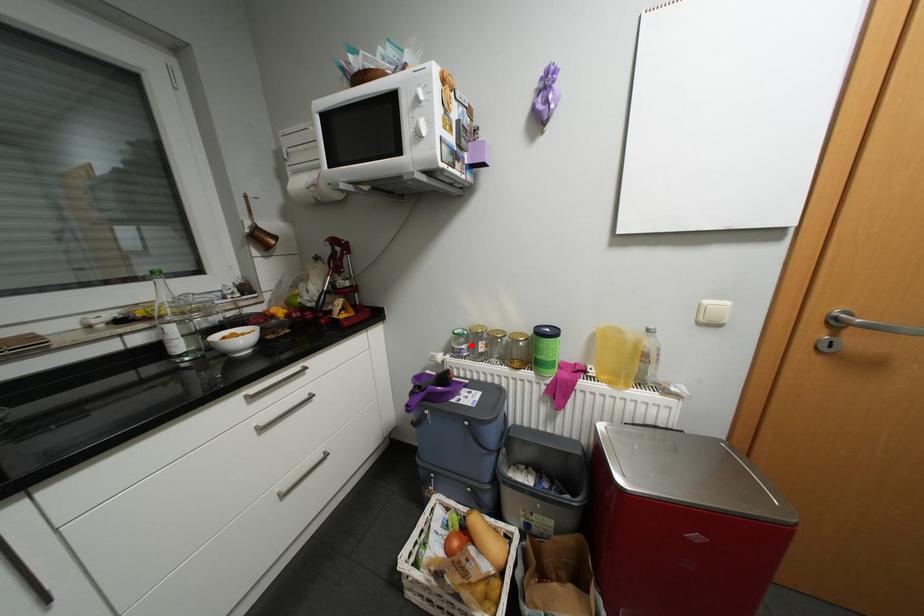
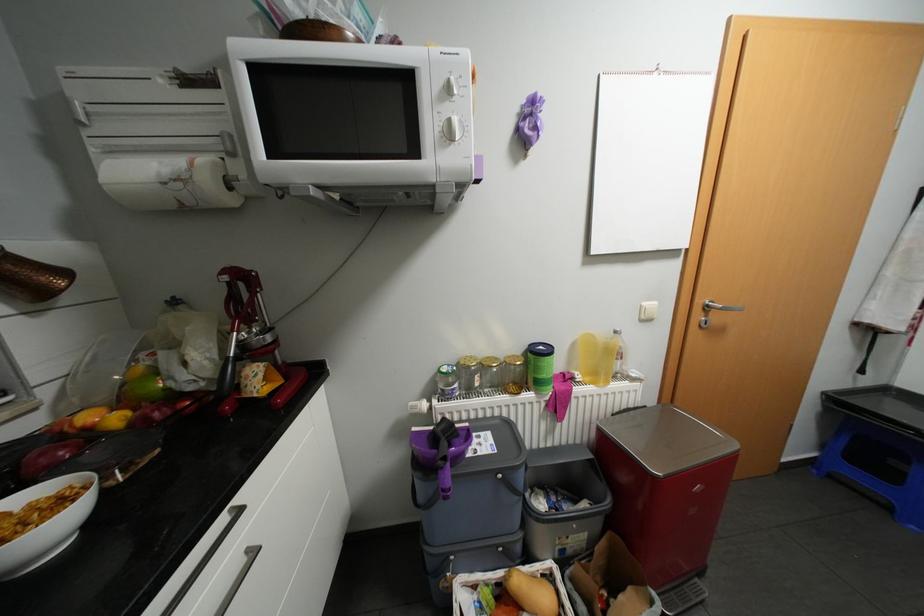
Where in the second image is the point corresponding to the highlighted location from the first image?

(464, 384)